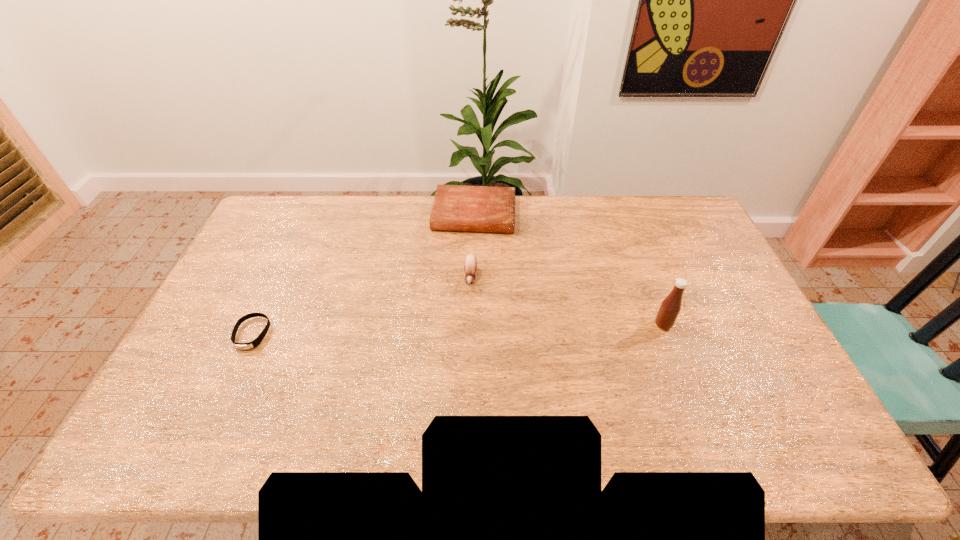
Where is `vacant region located 0.090m on the spine side of the Bible`? The image size is (960, 540). vacant region located 0.090m on the spine side of the Bible is located at coordinates (468, 252).

The image size is (960, 540). In order to click on free location located on the spine side of the Bible in this screenshot , I will do `click(468, 258)`.

Locate an element on the screen. The height and width of the screenshot is (540, 960). blank space located 0.080m on the spine side of the Bible is located at coordinates (469, 250).

Identify the location of blank space located 0.380m on the front-facing side of the second tallest object. Image resolution: width=960 pixels, height=540 pixels. (460, 401).

Identify the location of free space located 0.300m on the front-facing side of the second tallest object. (463, 373).

The height and width of the screenshot is (540, 960). Identify the location of vacant space located 0.130m on the front-facing side of the second tallest object. (468, 323).

At what (x,y) coordinates should I click in order to perform the action: click on object at the far edge. Please return your answer as a coordinate pair (x, y). The height and width of the screenshot is (540, 960). Looking at the image, I should click on (456, 207).

Locate an element on the screen. The height and width of the screenshot is (540, 960). object that is positioned at the left edge is located at coordinates coord(250,345).

This screenshot has width=960, height=540. In order to click on free location at the far edge in this screenshot , I will do `click(382, 204)`.

Where is `vacant space at the near edge of the desktop`? The height and width of the screenshot is (540, 960). vacant space at the near edge of the desktop is located at coordinates (449, 407).